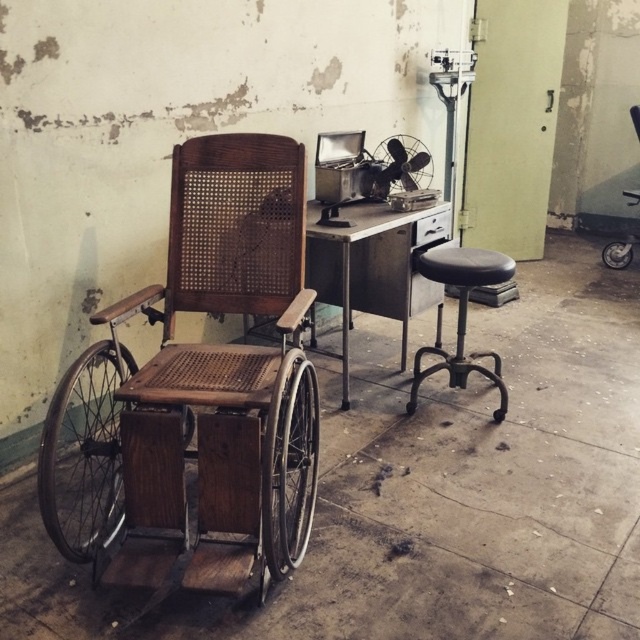
You are a maintenance worker in an old office and need to reach a high shelf. You see a metallic silver fan at center and a black leather swivel chair at right. Which object should you use to stand on to reach the shelf?

The black leather swivel chair at right is taller than the metallic silver fan at center, so you should use the black leather swivel chair at right to stand on to reach the shelf.

You are a maintenance worker needing to reach the metallic silver fan at center and the black leather swivel chair at right. Which object is closer to you?

The metallic silver fan at center is closer to the viewer than the black leather swivel chair at right, so you can reach the metallic silver fan at center first.